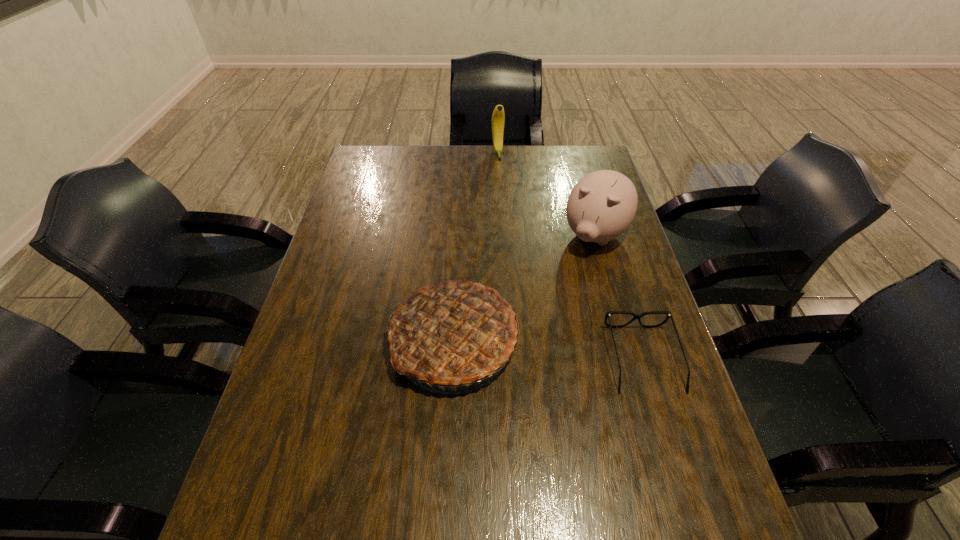
Select which object is the third closest to the farthest object. Please provide its 2D coordinates. Your answer should be formatted as a tuple, i.e. [(x, y)], where the tuple contains the x and y coordinates of a point satisfying the conditions above.

[(636, 316)]

Locate which object ranks third in proximity to the pie. Please provide its 2D coordinates. Your answer should be formatted as a tuple, i.e. [(x, y)], where the tuple contains the x and y coordinates of a point satisfying the conditions above.

[(498, 117)]

Identify the location of vacant region that satisfies the following two spatial constraints: 1. on the back side of the farthest object; 2. on the left side of the pie. The image size is (960, 540). (463, 152).

The height and width of the screenshot is (540, 960). Find the location of `vacant space that satisfies the following two spatial constraints: 1. on the front side of the farthest object; 2. on the right side of the piggy bank`. vacant space that satisfies the following two spatial constraints: 1. on the front side of the farthest object; 2. on the right side of the piggy bank is located at coordinates (502, 235).